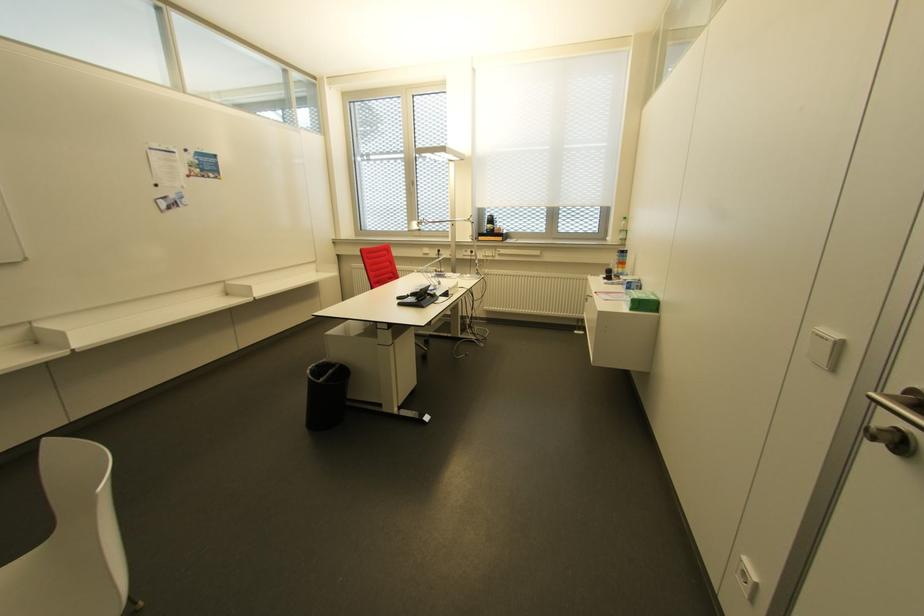
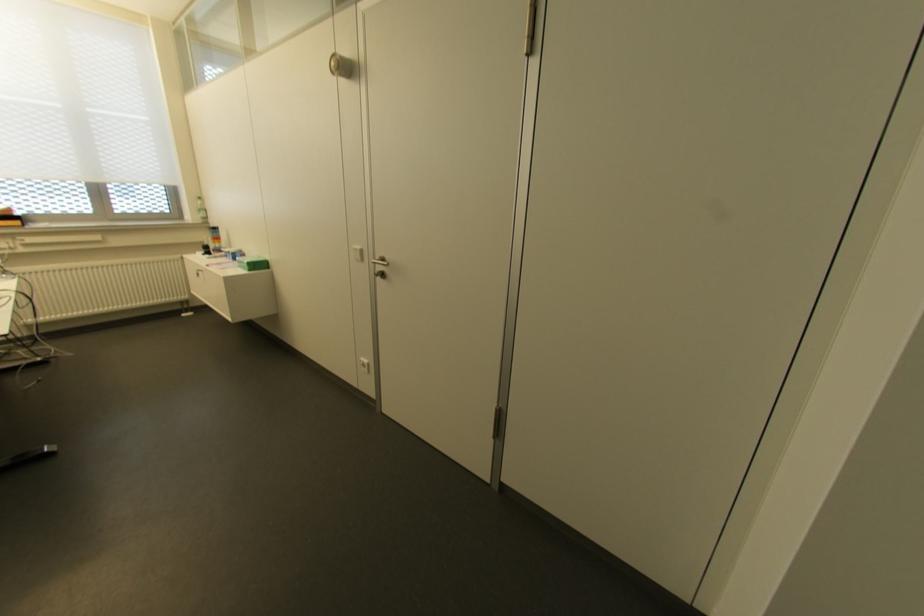
The point at (623, 240) is marked in the first image. Where is the corresponding point in the second image?

(204, 217)